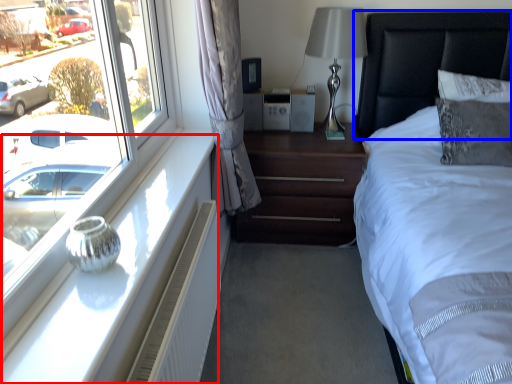
Question: Which object appears closest to the camera in this image, window sill (highlighted by a red box) or headboard (highlighted by a blue box)?

Choices:
 (A) window sill
 (B) headboard

Answer: (A)